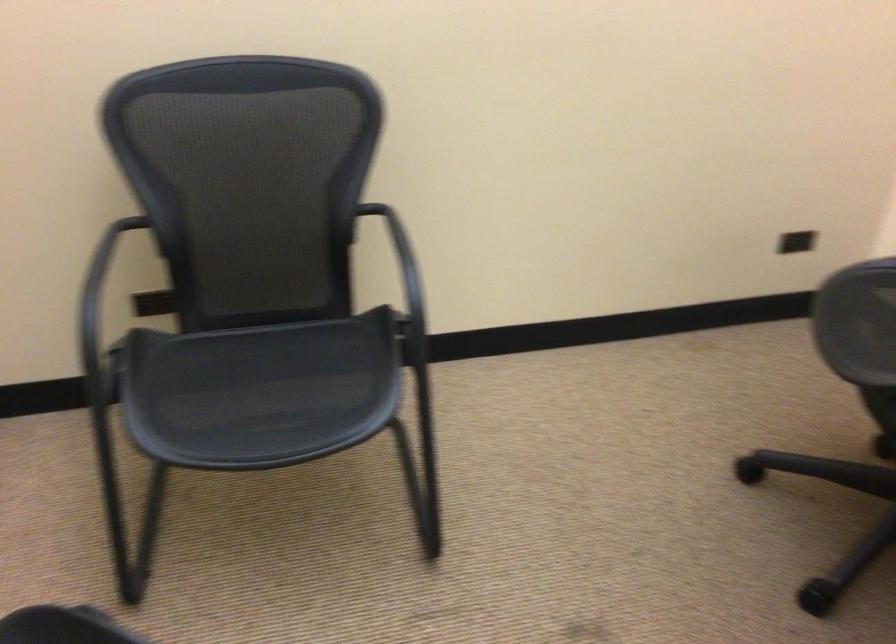
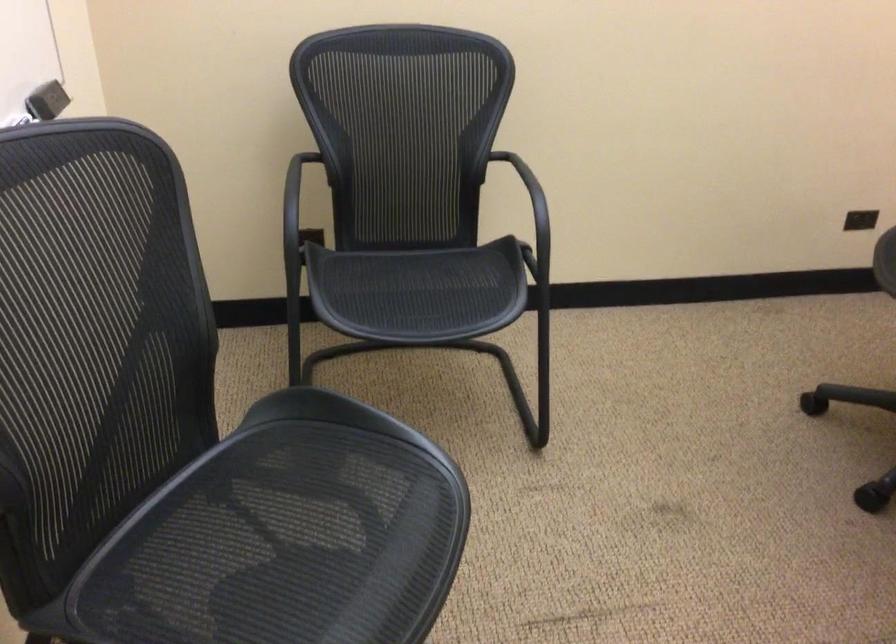
Question: Which direction would the cameraman need to move to produce the second image? Reply with the corresponding letter.

Choices:
 (A) Left
 (B) Right
 (C) Forward
 (D) Backward

Answer: (D)